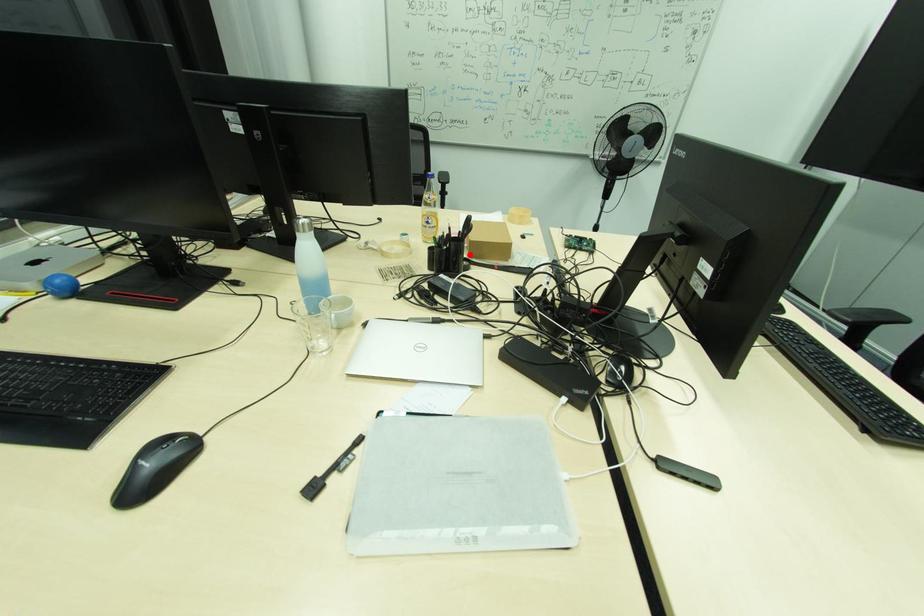
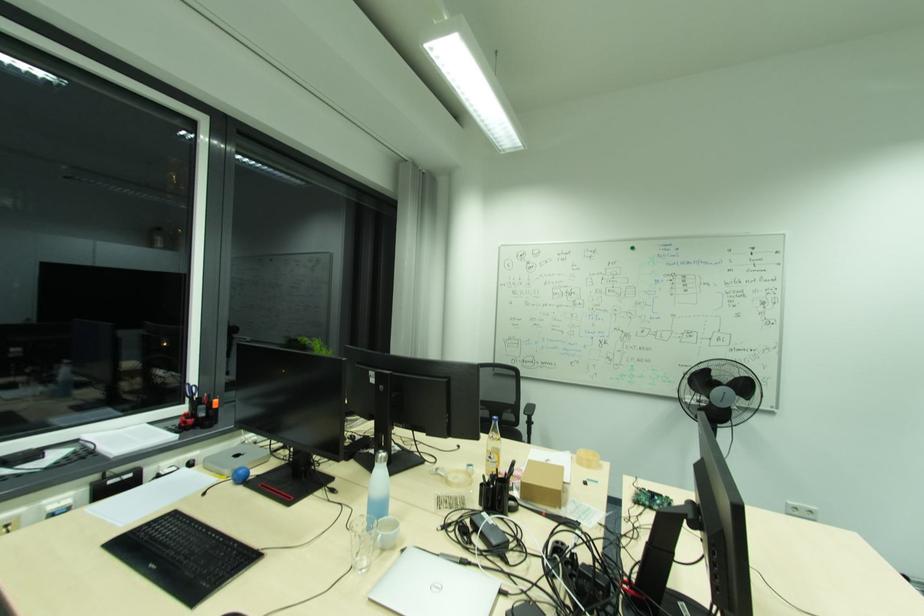
Find the pixel in the second image that matches the highlighted location in the first image.

(520, 495)